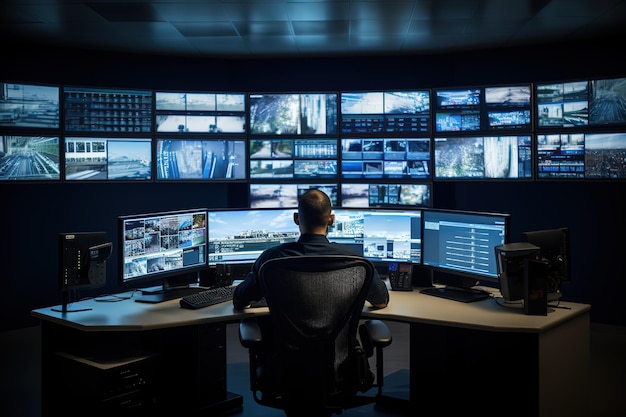
This screenshot has height=417, width=626. What are the coordinates of `video screens in the middle row` in the screenshot? It's located at (29, 152), (95, 152), (202, 152), (279, 155), (367, 155), (474, 157), (583, 157).